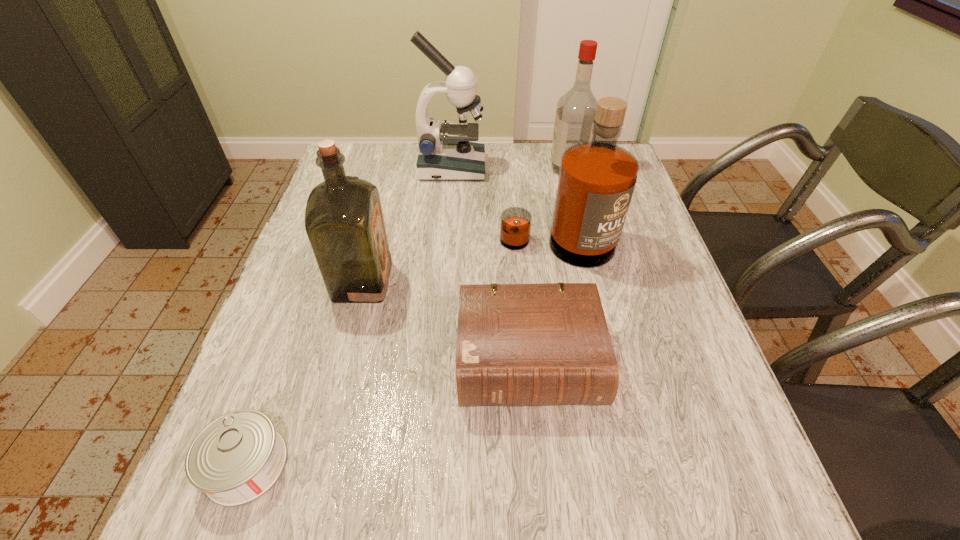
Image resolution: width=960 pixels, height=540 pixels. I want to click on object that is positioned at the far right corner, so click(x=576, y=109).

At what (x,y) coordinates should I click in order to perform the action: click on vacant space at the far edge. Please return your answer as a coordinate pair (x, y). This screenshot has height=540, width=960. Looking at the image, I should click on (393, 178).

The height and width of the screenshot is (540, 960). I want to click on vacant region at the near edge of the desktop, so click(x=589, y=512).

Where is `vacant space at the left edge`? vacant space at the left edge is located at coordinates (277, 299).

Locate an element on the screen. This screenshot has width=960, height=540. free space at the right edge of the desktop is located at coordinates (664, 253).

In the image, there is a desktop. What are the coordinates of `vacant space at the far left corner` in the screenshot? It's located at (371, 171).

Locate an element on the screen. The height and width of the screenshot is (540, 960). free space between the Bible and the leftmost liquor is located at coordinates (x=445, y=322).

You are a GUI agent. You are given a task and a screenshot of the screen. Output one action in this format:
    pyautogui.click(x=<x>, y=<y>)
    Task: Click on the free space between the Bible and the farthest liquor
    
    Given the screenshot: What is the action you would take?
    pyautogui.click(x=549, y=265)

The image size is (960, 540). I want to click on vacant space in between the fifth tallest object and the microscope, so click(491, 265).

At what (x,y) coordinates should I click in order to perform the action: click on free area in between the second shortest object and the nearest object. Please return your answer as a coordinate pair (x, y). Looking at the image, I should click on (388, 414).